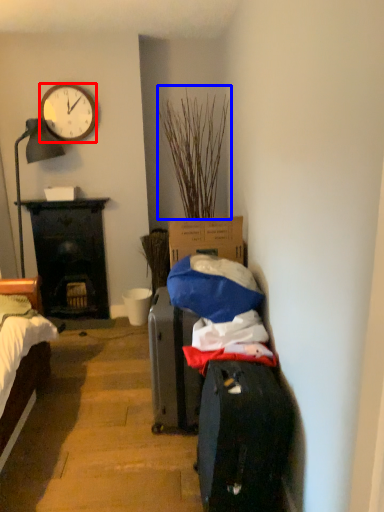
Question: Which point is closer to the camera, clock (highlighted by a red box) or plant (highlighted by a blue box)?

Choices:
 (A) clock
 (B) plant

Answer: (B)